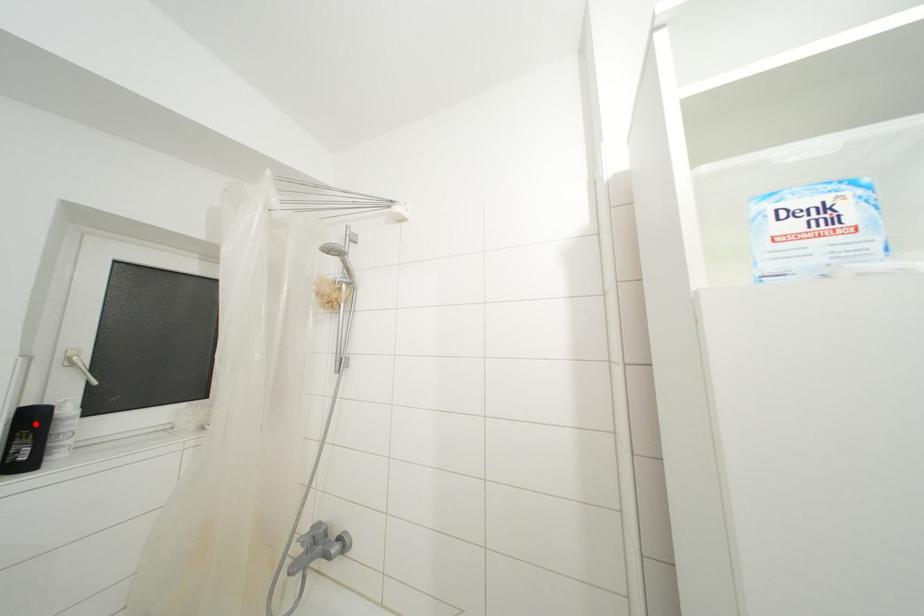
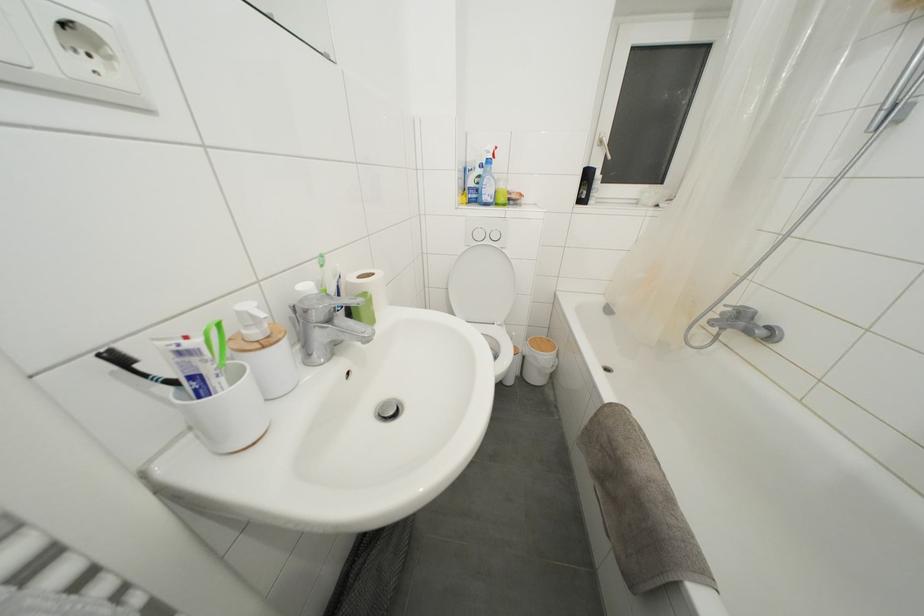
In the second image, find the point that corresponds to the highlighted location in the first image.

(591, 180)